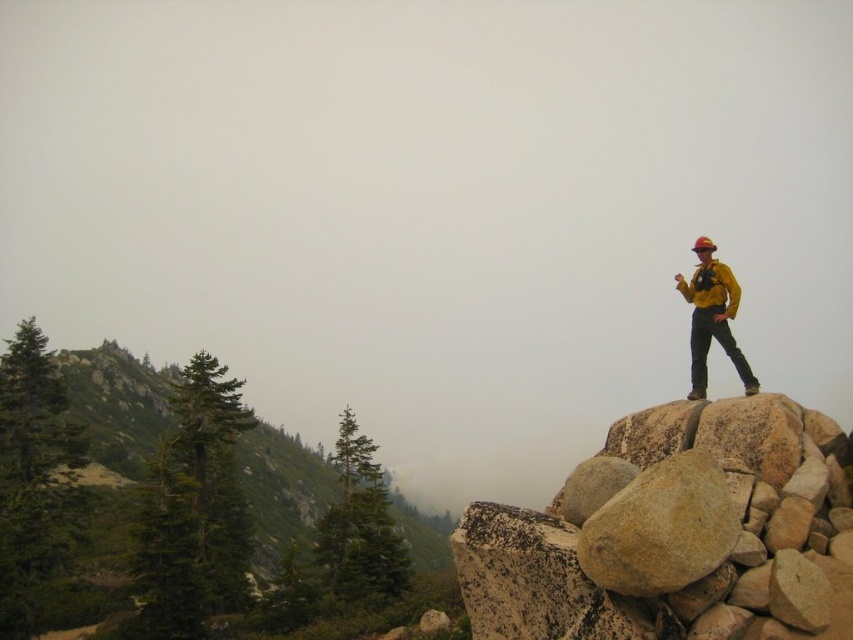
You are a hiker trying to navigate through the rocky terrain in the image. You see two points marked on the rocks. Which point is closer to you, point (24, 620) or point (718, 289)?

Point (24, 620) is closer to you because it is further to the viewer than point (718, 289).